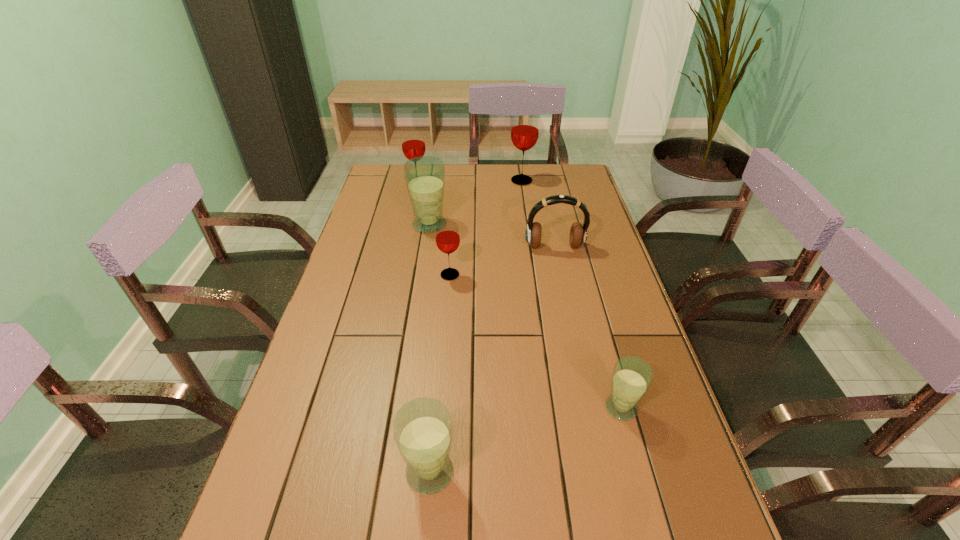
The height and width of the screenshot is (540, 960). I want to click on the nearest glass, so tap(422, 428).

The width and height of the screenshot is (960, 540). What are the coordinates of `the rightmost blue glass` in the screenshot? It's located at (631, 378).

The height and width of the screenshot is (540, 960). In order to click on the second farthest blue glass in this screenshot , I will do `click(631, 378)`.

Locate an element on the screen. The width and height of the screenshot is (960, 540). vacant space located 0.120m on the front of the rightmost red glass is located at coordinates (525, 204).

Locate an element on the screen. The height and width of the screenshot is (540, 960). free space located 0.120m on the back of the second biggest red glass is located at coordinates (421, 167).

You are a GUI agent. You are given a task and a screenshot of the screen. Output one action in this format:
    pyautogui.click(x=<x>, y=<y>)
    Task: Click on the vacant space located on the back of the farthest blue glass
    This screenshot has width=960, height=540.
    Given the screenshot: What is the action you would take?
    pyautogui.click(x=436, y=180)

Locate an element on the screen. vacant space located on the ear cup of the fourth farthest object is located at coordinates (564, 294).

Identify the location of vacant space located on the back of the nearest red glass. The width and height of the screenshot is (960, 540). (455, 205).

Find the location of a particular element. The height and width of the screenshot is (540, 960). free space located 0.070m on the right of the nearest glass is located at coordinates (492, 472).

The height and width of the screenshot is (540, 960). Identify the location of free spot located on the back of the rightmost glass. (591, 302).